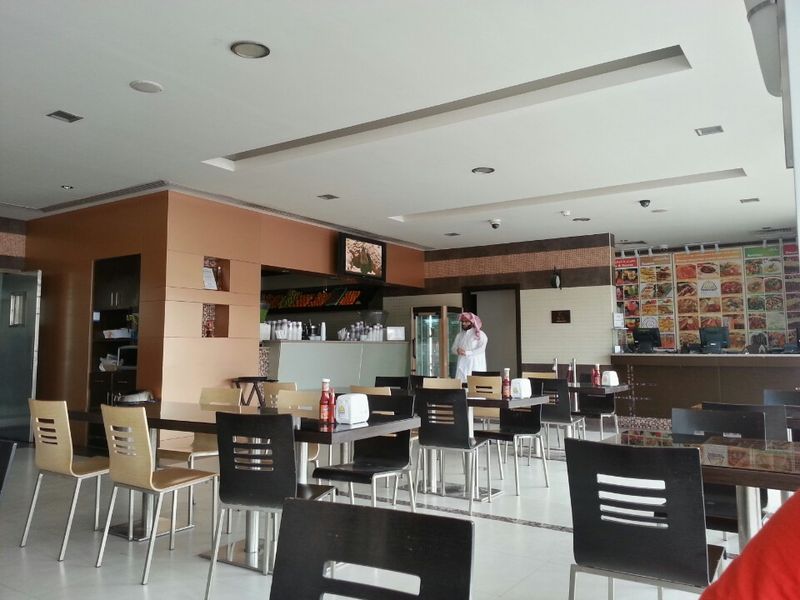
The image size is (800, 600). I want to click on door, so click(x=18, y=312), click(x=18, y=370).